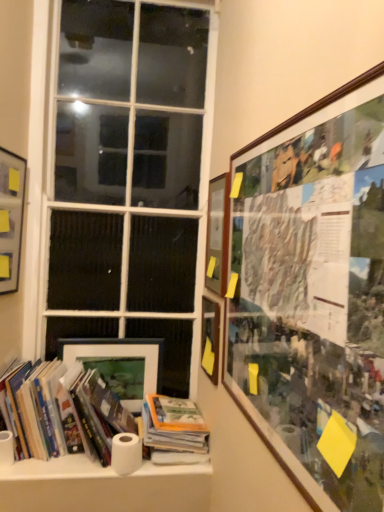
Find the location of `free space to the right of white matte toilet paper at lower center`. free space to the right of white matte toilet paper at lower center is located at coordinates 166,466.